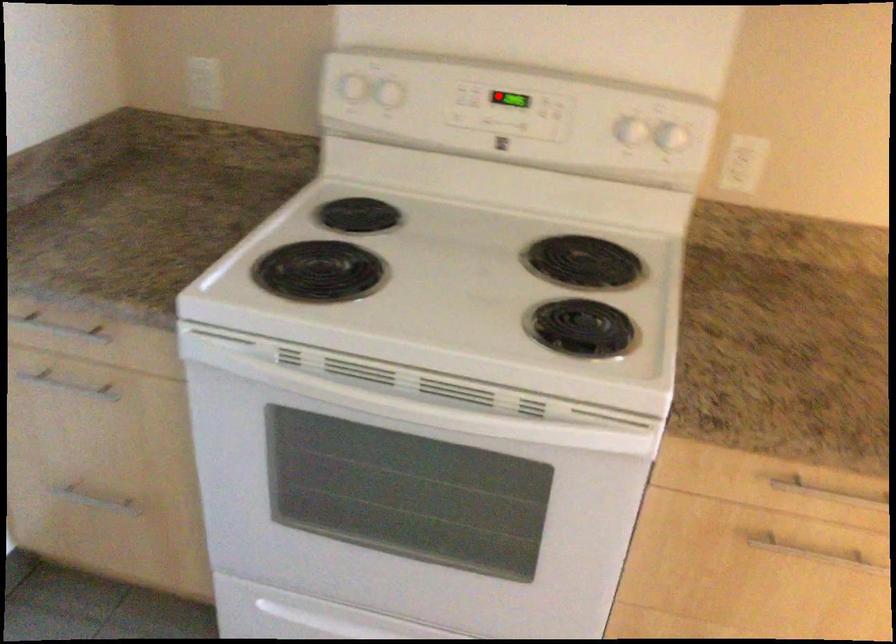
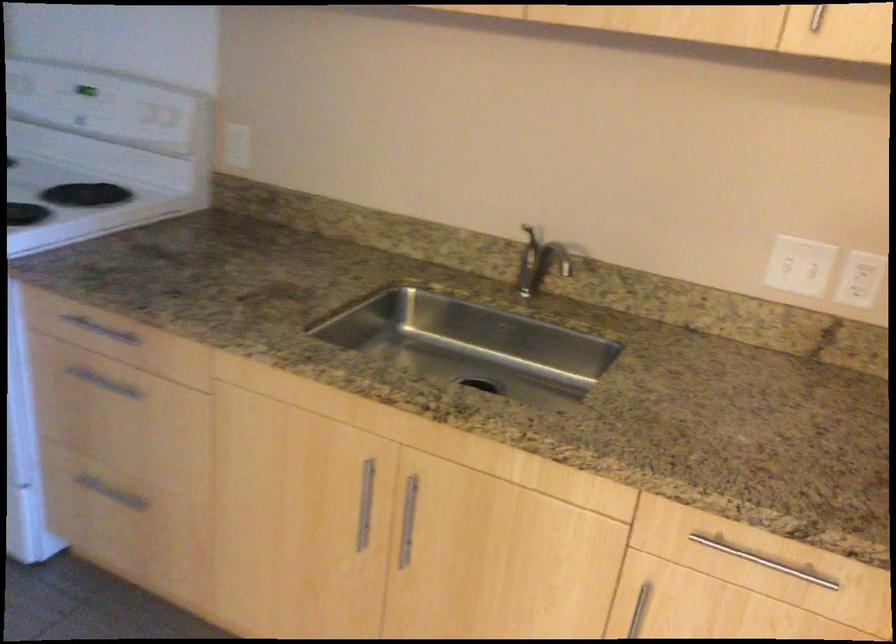
Question: I am providing you with two images of the same scene from different viewpoints. In image1, a red point is highlighted. Considering the same 3D point in image2, which of the following is correct?

Choices:
 (A) It is closer
 (B) It is farther

Answer: (B)